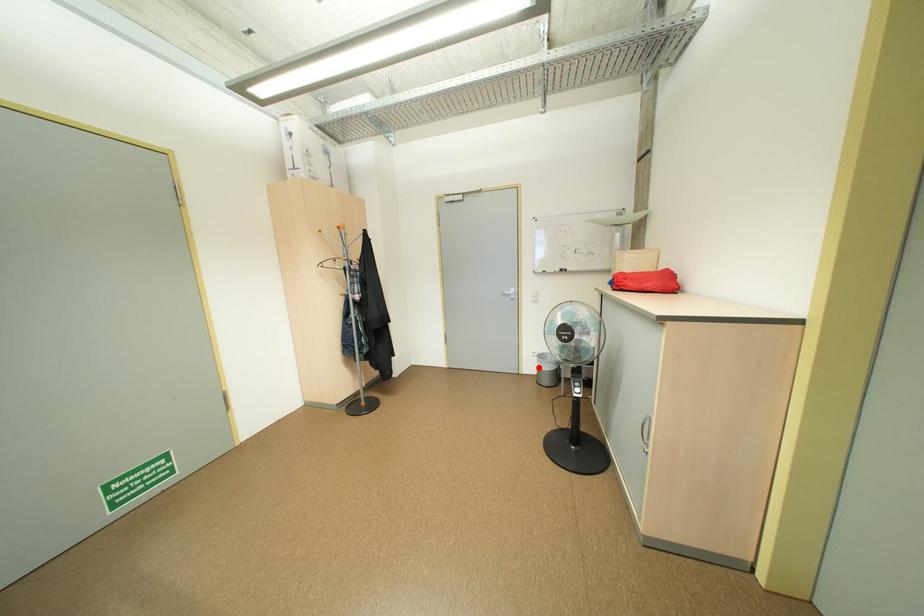
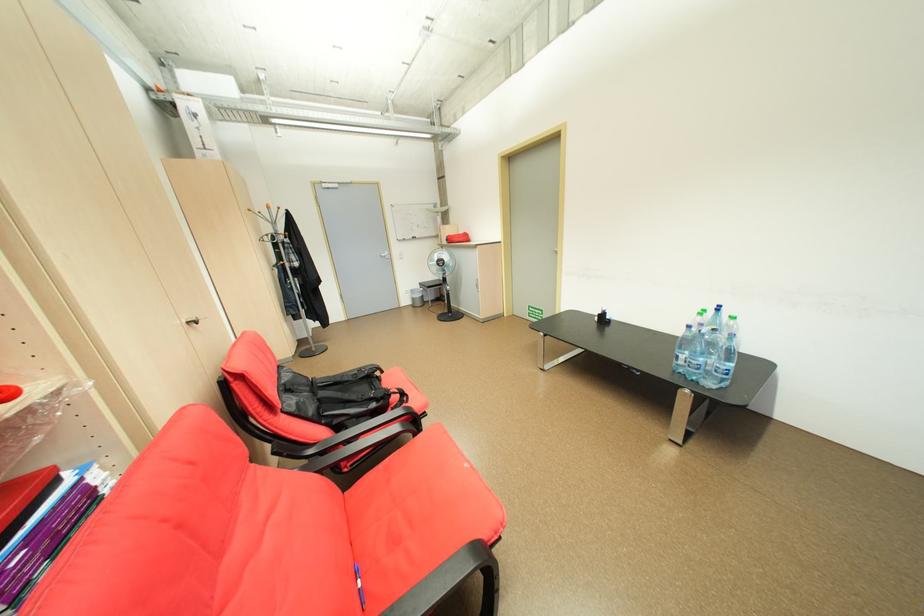
Question: I am providing you with two images of the same scene from different viewpoints. In image1, a red point is highlighted. Considering the same 3D point in image2, which of the following is correct?

Choices:
 (A) It is closer
 (B) It is farther

Answer: (A)